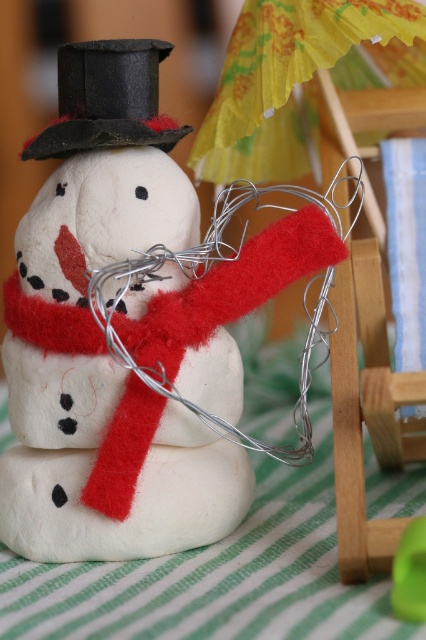
Does point (152, 182) come in front of point (296, 364)?

Yes, point (152, 182) is in front of point (296, 364).

Who is more forward, (x=213, y=531) or (x=65, y=579)?

Positioned in front is point (x=65, y=579).

I want to click on felt white snowman at center, so click(98, 458).

Is point (20, 225) more distant than point (164, 124)?

Yes, point (20, 225) is behind point (164, 124).

Can you confirm if felt white snowman at center is positioned to the right of black felt hat at upper center?

Yes, felt white snowman at center is to the right of black felt hat at upper center.

Locate an element on the screen. Image resolution: width=426 pixels, height=640 pixels. felt white snowman at center is located at coordinates (98, 458).

Measure the distance between point (258, 570) and camera.

30.95 inches

Can you confirm if green striped fabric at lower center is positioned to the right of black felt hat at upper center?

Correct, you'll find green striped fabric at lower center to the right of black felt hat at upper center.

Who is more distant from viewer, (190, 630) or (147, 97)?

The point (147, 97) is more distant.

Where is `green striped fabric at lower center`? The width and height of the screenshot is (426, 640). green striped fabric at lower center is located at coordinates pos(219,572).